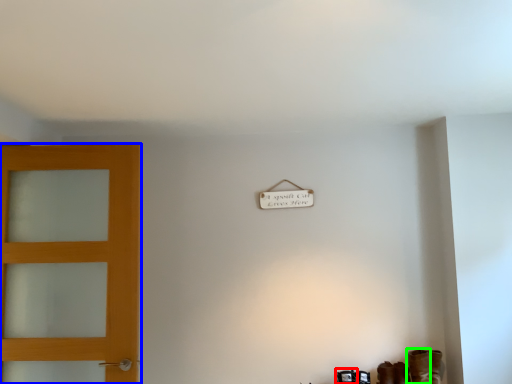
Question: Which object is the closest to the shoe (highlighted by a red box)? Choose among these: door (highlighted by a blue box) or boot (highlighted by a green box).

Choices:
 (A) door
 (B) boot

Answer: (B)